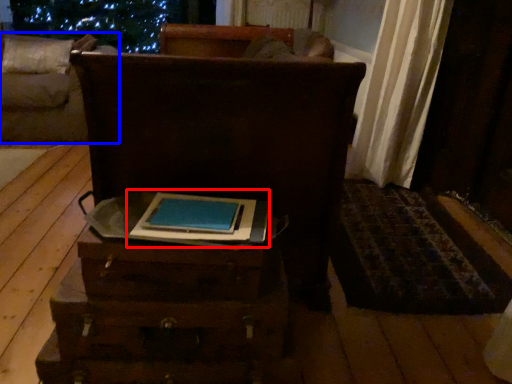
Question: Among these objects, which one is nearest to the camera, book (highlighted by a red box) or furniture (highlighted by a blue box)?

Choices:
 (A) book
 (B) furniture

Answer: (A)